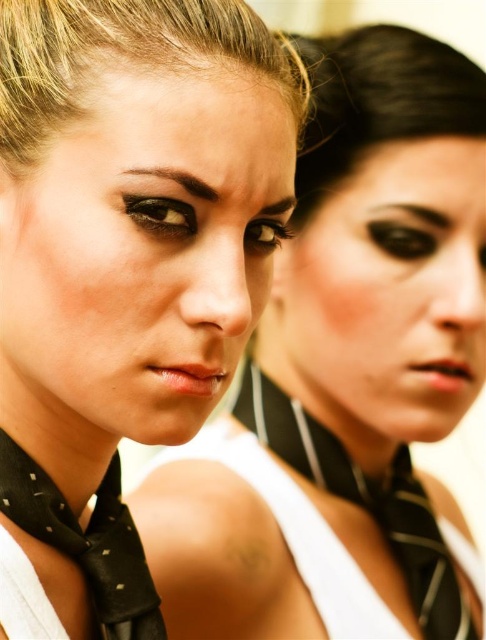
Question: Which point is farther to the camera?

Choices:
 (A) matte black scarf at center
 (B) matte black scarf at left

Answer: (B)

Question: Is matte black scarf at left smaller than black dotted silk tie at lower left?

Choices:
 (A) yes
 (B) no

Answer: (B)

Question: Which object is positioned closest to the black dotted silk tie at lower left?

Choices:
 (A) black striped tie at center
 (B) matte black scarf at left

Answer: (B)

Question: Among these objects, which one is nearest to the camera?

Choices:
 (A) black dotted silk tie at lower left
 (B) matte black scarf at left
 (C) matte black scarf at center
 (D) black striped tie at center

Answer: (C)

Question: Does matte black scarf at center have a greater width compared to matte black scarf at left?

Choices:
 (A) yes
 (B) no

Answer: (B)

Question: Does matte black scarf at center appear on the left side of black striped tie at center?

Choices:
 (A) yes
 (B) no

Answer: (A)